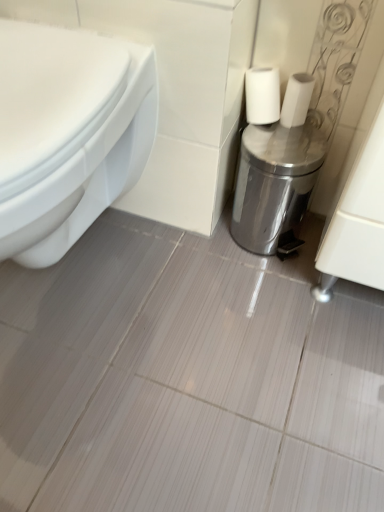
Question: Considering the positions of white glossy toilet at left and white matte toilet paper at center in the image, is white glossy toilet at left taller or shorter than white matte toilet paper at center?

Choices:
 (A) tall
 (B) short

Answer: (A)

Question: Does point (99, 129) appear closer or farther from the camera than point (306, 74)?

Choices:
 (A) farther
 (B) closer

Answer: (B)

Question: Which object is positioned farthest from the white glossy toilet at left?

Choices:
 (A) silver metallic trash can at right
 (B) white matte toilet paper at center

Answer: (B)

Question: Which object is the farthest from the white matte toilet paper at center?

Choices:
 (A) white glossy toilet at left
 (B) silver metallic trash can at right

Answer: (A)